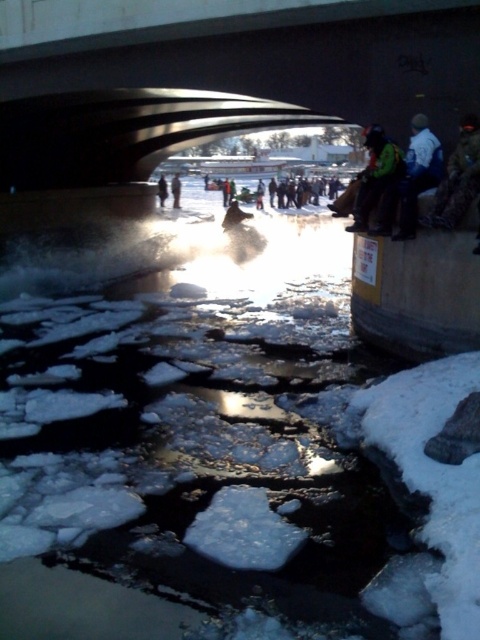
Question: Which object is the farthest from the green fabric jacket at right?

Choices:
 (A) dark gray jacket at center
 (B) dark blue jacket at center

Answer: (A)

Question: Is green fabric jacket at right behind dark gray jacket at center?

Choices:
 (A) yes
 (B) no

Answer: (B)

Question: Considering the real-world distances, which object is farthest from the green fabric jacket at right?

Choices:
 (A) dark blue jacket at center
 (B) dark gray jacket at center
 (C) dark blue jacket at upper right

Answer: (B)

Question: In this image, where is green fabric jacket at right located relative to dark blue jacket at center?

Choices:
 (A) left
 (B) right

Answer: (B)

Question: Is green fabric jacket at right wider than dark blue jacket at upper right?

Choices:
 (A) no
 (B) yes

Answer: (A)

Question: Which object is closer to the camera taking this photo?

Choices:
 (A) dark gray jacket at center
 (B) green fabric jacket at right
 (C) dark blue jacket at upper right

Answer: (C)